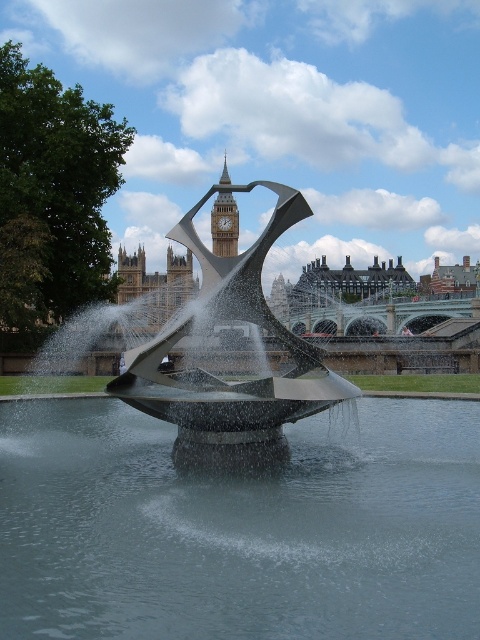
Is point (424, 515) positioned before point (227, 273)?

Yes.

Who is positioned more to the left, clear water at center or polished stainless steel sculpture at center?

polished stainless steel sculpture at center

Find the location of `clear water at center`. clear water at center is located at coordinates (240, 528).

Image resolution: width=480 pixels, height=640 pixels. Find the location of `clear water at center`. clear water at center is located at coordinates (240, 528).

Who is positioned more to the left, polished stainless steel sculpture at center or polished stone clock tower at upper center?

From the viewer's perspective, polished stone clock tower at upper center appears more on the left side.

Who is shorter, polished stainless steel sculpture at center or polished stone clock tower at upper center?

polished stone clock tower at upper center is shorter.

Is point (204, 196) farther from viewer compared to point (226, 163)?

No.

The width and height of the screenshot is (480, 640). What are the coordinates of `polished stainless steel sculpture at center` in the screenshot? It's located at (227, 380).

How far apart are clear water at center and polished stone clock tower at upper center?

clear water at center is 96.86 meters from polished stone clock tower at upper center.

Does clear water at center have a greater width compared to polished stone clock tower at upper center?

Yes.

Locate an element on the screen. The image size is (480, 640). clear water at center is located at coordinates (240, 528).